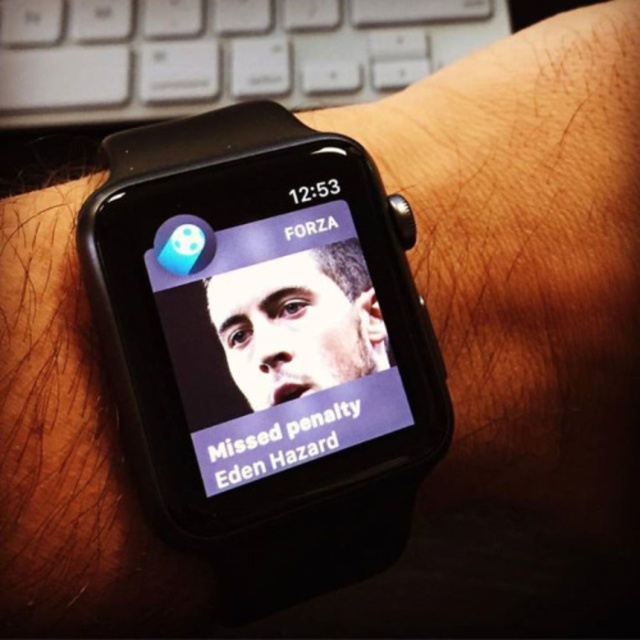
Question: Which point is closer to the camera taking this photo?

Choices:
 (A) (355, 260)
 (B) (298, 60)

Answer: (A)

Question: Can you confirm if black matte smartwatch at center is positioned to the right of smooth skin face at center?

Choices:
 (A) yes
 (B) no

Answer: (B)

Question: Is matte purple watch face at center positioned in front of white plastic keyboard at upper left?

Choices:
 (A) yes
 (B) no

Answer: (A)

Question: Among these points, which one is farthest from the camera?

Choices:
 (A) (260, 353)
 (B) (378, 356)
 (C) (385, 284)

Answer: (C)

Question: Which object appears closest to the camera in this image?

Choices:
 (A) smooth skin face at center
 (B) black matte smartwatch at center

Answer: (B)

Question: Does black matte smartwatch at center appear over smooth skin face at center?

Choices:
 (A) yes
 (B) no

Answer: (A)